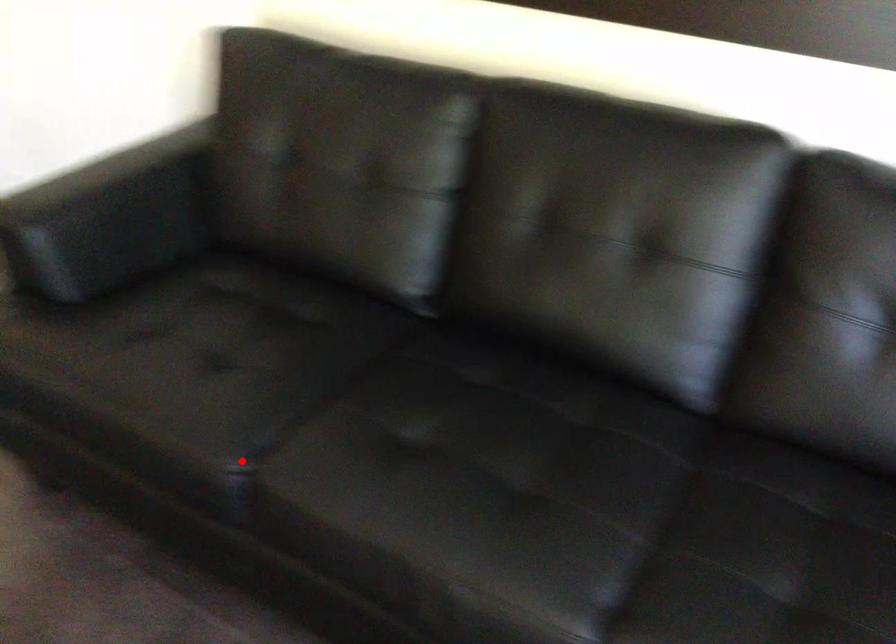
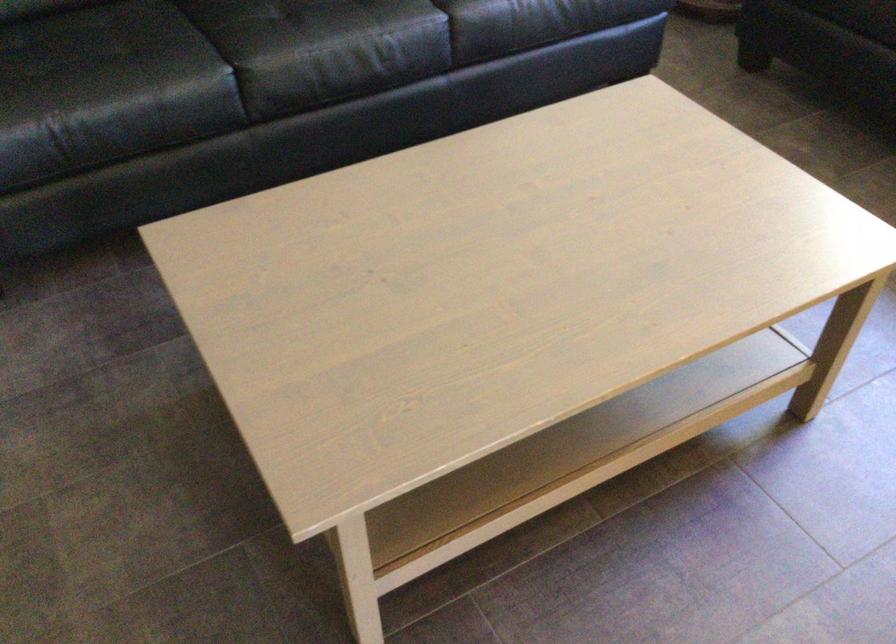
Question: I am providing you with two images of the same scene from different viewpoints. Given a red point in image1, look at the same physical point in image2. Is it:

Choices:
 (A) Closer to the viewpoint
 (B) Farther from the viewpoint

Answer: (B)